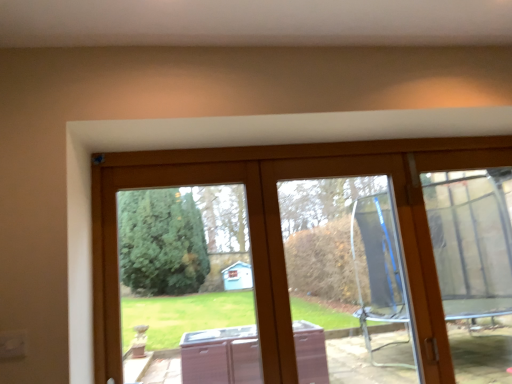
What do you see at coordinates (338, 264) in the screenshot?
I see `clear glass door at center` at bounding box center [338, 264].

This screenshot has width=512, height=384. What do you see at coordinates (285, 263) in the screenshot?
I see `transparent glass door at center` at bounding box center [285, 263].

Measure the distance between point (x=468, y=362) and camera.

Point (x=468, y=362) is 2.54 meters from camera.

Image resolution: width=512 pixels, height=384 pixels. What do you see at coordinates (474, 267) in the screenshot?
I see `clear plastic screen door at right` at bounding box center [474, 267].

Where is `clear glass door at center`? clear glass door at center is located at coordinates (338, 264).

Looking at this image, which is more to the left, clear glass door at center or clear plastic screen door at right?

Positioned to the left is clear glass door at center.

In the scene shown: Who is shorter, clear glass door at center or clear plastic screen door at right?

clear glass door at center.

Based on the photo, between clear glass door at center and clear plastic screen door at right, which one has smaller size?

With smaller size is clear glass door at center.

From the image's perspective, who appears lower, clear glass door at center or clear plastic screen door at right?

clear glass door at center is shown below in the image.

How different are the orientations of transparent glass door at center and clear plastic screen door at right in degrees?

transparent glass door at center and clear plastic screen door at right are facing 0.673 degrees away from each other.

Between transparent glass door at center and clear plastic screen door at right, which one has smaller width?

clear plastic screen door at right.

Is transparent glass door at center far from clear plastic screen door at right?

Yes.

Which point is more distant from viewer, [258,253] or [505,309]?

Positioned behind is point [505,309].

Looking at this image, would you say clear plastic screen door at right is inside or outside clear glass door at center?

clear plastic screen door at right is spatially situated outside clear glass door at center.

From the image's perspective, who appears lower, clear plastic screen door at right or clear glass door at center?

From the image's view, clear glass door at center is below.

Can you confirm if clear plastic screen door at right is wider than clear glass door at center?

Yes.

Is clear plastic screen door at right taller or shorter than clear glass door at center?

Considering their sizes, clear plastic screen door at right has more height than clear glass door at center.

Would you say clear plastic screen door at right contains transparent glass door at center?

No, clear plastic screen door at right does not contain transparent glass door at center.

How different are the orientations of clear plastic screen door at right and transparent glass door at center in degrees?

The angular difference between clear plastic screen door at right and transparent glass door at center is 0.673 degrees.

Consider the image. From a real-world perspective, relative to transparent glass door at center, is clear plastic screen door at right vertically above or below?

Clearly, from a real-world perspective, clear plastic screen door at right is above transparent glass door at center.

Considering the sizes of objects clear plastic screen door at right and transparent glass door at center in the image provided, who is shorter, clear plastic screen door at right or transparent glass door at center?

transparent glass door at center.

In terms of size, does transparent glass door at center appear bigger or smaller than clear glass door at center?

In the image, transparent glass door at center appears to be larger than clear glass door at center.

Is transparent glass door at center completely or partially outside of clear glass door at center?

transparent glass door at center is positioned outside clear glass door at center.

Does transparent glass door at center have a lesser height compared to clear glass door at center?

Yes, transparent glass door at center is shorter than clear glass door at center.

Which is more to the right, transparent glass door at center or clear glass door at center?

clear glass door at center is more to the right.

Considering the relative sizes of clear glass door at center and transparent glass door at center in the image provided, is clear glass door at center smaller than transparent glass door at center?

Yes, clear glass door at center is smaller than transparent glass door at center.

Is clear glass door at center further to camera compared to transparent glass door at center?

That is True.

Consider the image. Is the surface of clear glass door at center in direct contact with transparent glass door at center?

Yes, clear glass door at center is with transparent glass door at center.

Can you confirm if clear glass door at center is positioned to the right of transparent glass door at center?

Indeed, clear glass door at center is positioned on the right side of transparent glass door at center.

Locate an element on the screen. This screenshot has width=512, height=384. window frame on the left of the clear plastic screen door at right is located at coordinates (338, 264).

The width and height of the screenshot is (512, 384). In order to click on glass door below the clear plastic screen door at right (from a real-world perspective) in this screenshot , I will do `click(285, 263)`.

Based on their spatial positions, is clear plastic screen door at right or clear glass door at center closer to transparent glass door at center?

Based on the image, clear glass door at center appears to be nearer to transparent glass door at center.

When comparing their distances from clear glass door at center, does transparent glass door at center or clear plastic screen door at right seem further?

clear plastic screen door at right.

From the image, which object appears to be farther from clear glass door at center, clear plastic screen door at right or transparent glass door at center?

The object further to clear glass door at center is clear plastic screen door at right.

From the image, which object appears to be nearer to clear plastic screen door at right, transparent glass door at center or clear glass door at center?

clear glass door at center is positioned closer to the anchor clear plastic screen door at right.

Looking at this image, which object lies nearer to the anchor point clear plastic screen door at right, clear glass door at center or transparent glass door at center?

clear glass door at center is positioned closer to the anchor clear plastic screen door at right.

Looking at the image, which one is located closer to transparent glass door at center, clear glass door at center or clear plastic screen door at right?

clear glass door at center is closer to transparent glass door at center.

Locate an element on the screen. The width and height of the screenshot is (512, 384). window frame between transparent glass door at center and clear plastic screen door at right is located at coordinates (338, 264).